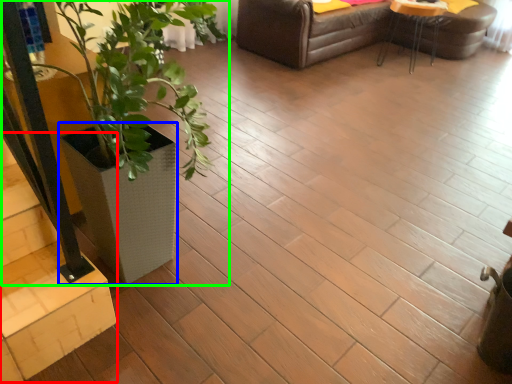
Question: Which object is the farthest from stairwell (highlighted by a red box)? Choose among these: flowerpot (highlighted by a blue box) or houseplant (highlighted by a green box).

Choices:
 (A) flowerpot
 (B) houseplant

Answer: (B)